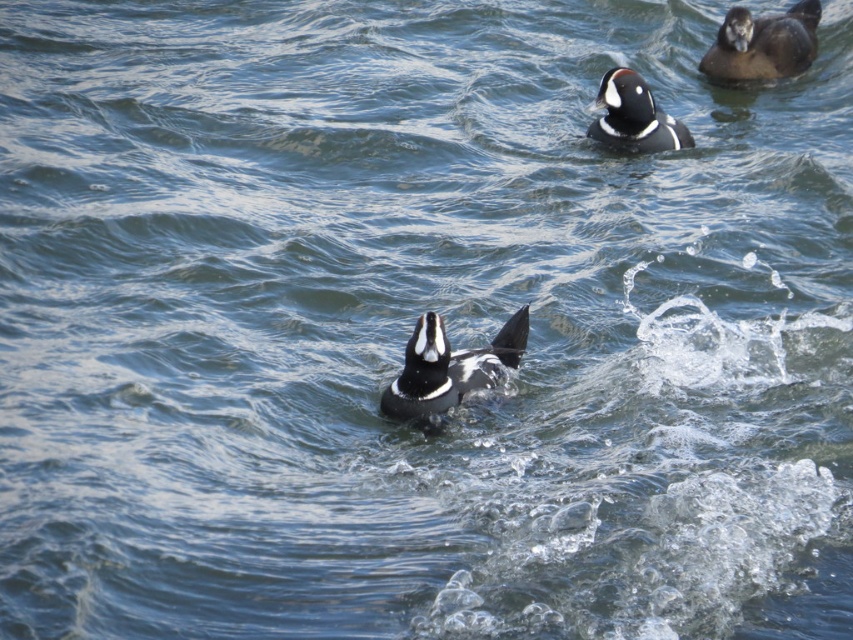
You are a photographer trying to capture the black and white duck at center in your shot. Based on the scene description, what are the coordinates of the duck in the image?

The coordinates of the black and white duck at center are at point (x=448, y=369).

You are a photographer trying to capture the Harlequin Ducks in the scene. You notice two points of interest labeled as point (x=466, y=356) and point (x=788, y=12). Which point is closer to your camera lens?

Point (x=466, y=356) is closer to the viewer than point (x=788, y=12), so the point closer to your camera lens is point (x=466, y=356).

You are a wildlife photographer aiming to capture a photo of both the brown matte duck at upper right and the black glossy duck at upper center. Based on their positions, which duck will appear larger in your photo?

The brown matte duck at upper right will appear larger in the photo because it is much taller than the black glossy duck at upper center.